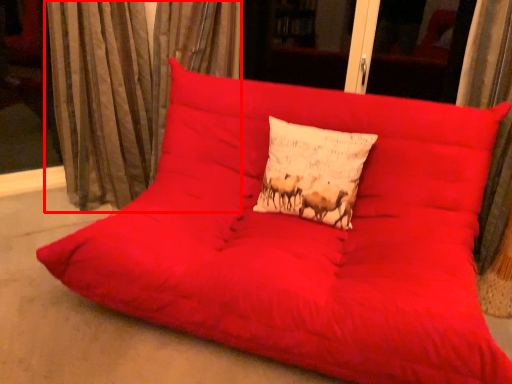
Question: Where is curtain (annotated by the red box) located in relation to pillow in the image?

Choices:
 (A) left
 (B) right

Answer: (A)